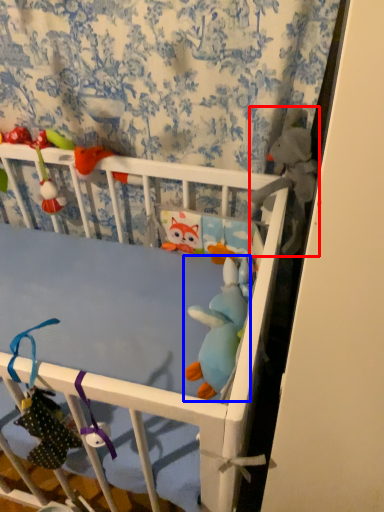
Question: Which point is further to the camera, toy (highlighted by a red box) or toy (highlighted by a blue box)?

Choices:
 (A) toy
 (B) toy

Answer: (A)